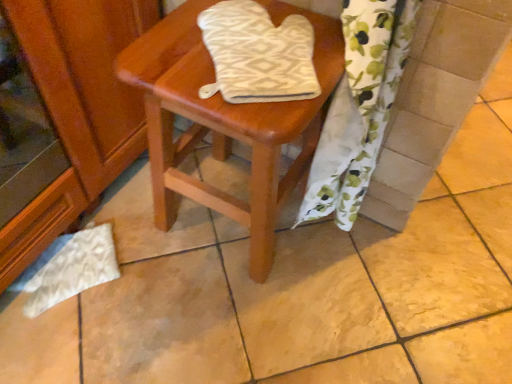
Question: Is white floral fabric at lower right thinner than wooden stool at center?

Choices:
 (A) yes
 (B) no

Answer: (A)

Question: Could you tell me if white floral fabric at lower right is facing wooden stool at center?

Choices:
 (A) no
 (B) yes

Answer: (B)

Question: Is the position of white floral fabric at lower right more distant than that of wooden stool at center?

Choices:
 (A) yes
 (B) no

Answer: (B)

Question: Can you confirm if white floral fabric at lower right is wider than wooden stool at center?

Choices:
 (A) no
 (B) yes

Answer: (A)

Question: Is there a large distance between white floral fabric at lower right and wooden stool at center?

Choices:
 (A) no
 (B) yes

Answer: (A)

Question: Considering the positions of white textured oven mitt at center and white floral fabric at lower right in the image, is white textured oven mitt at center taller or shorter than white floral fabric at lower right?

Choices:
 (A) short
 (B) tall

Answer: (A)

Question: Considering the positions of point pyautogui.click(x=306, y=82) and point pyautogui.click(x=380, y=125), is point pyautogui.click(x=306, y=82) closer or farther from the camera than point pyautogui.click(x=380, y=125)?

Choices:
 (A) closer
 (B) farther

Answer: (A)

Question: Is white textured oven mitt at center spatially inside white floral fabric at lower right, or outside of it?

Choices:
 (A) outside
 (B) inside

Answer: (B)

Question: Is white textured oven mitt at center in front of or behind white floral fabric at lower right in the image?

Choices:
 (A) behind
 (B) front

Answer: (A)

Question: Is point (358, 140) closer or farther from the camera than point (194, 18)?

Choices:
 (A) closer
 (B) farther

Answer: (B)

Question: Is white floral fabric at lower right spatially inside wooden stool at center, or outside of it?

Choices:
 (A) inside
 (B) outside

Answer: (A)

Question: From the image's perspective, is white floral fabric at lower right positioned above or below wooden stool at center?

Choices:
 (A) below
 (B) above

Answer: (B)

Question: From a real-world perspective, is white floral fabric at lower right above or below wooden stool at center?

Choices:
 (A) above
 (B) below

Answer: (A)

Question: Is white textured oven mitt at center inside the boundaries of wooden stool at center, or outside?

Choices:
 (A) outside
 (B) inside

Answer: (A)

Question: From the image's perspective, relative to wooden stool at center, is white textured oven mitt at center above or below?

Choices:
 (A) below
 (B) above

Answer: (B)